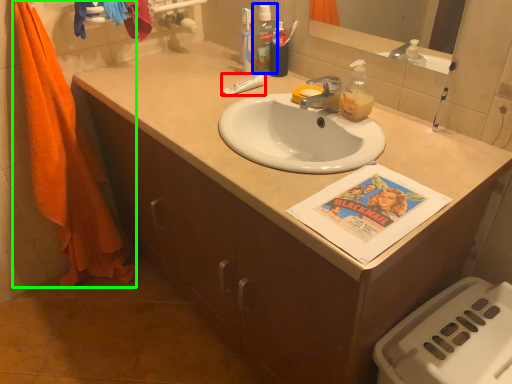
Question: Based on their relative distances, which object is nearer to toothpaste (highlighted by a red box)? Choose from mouthwash (highlighted by a blue box) and beach towel (highlighted by a green box).

Choices:
 (A) mouthwash
 (B) beach towel

Answer: (A)